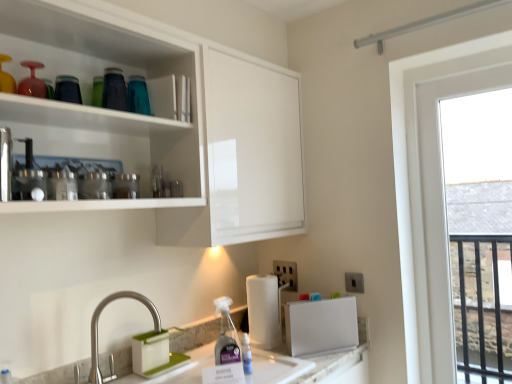
Question: Visually, is white plastic magnetic board at lower center, which is counted as the first appliance, starting from the right, positioned to the left or to the right of white matte paper towel at lower center?

Choices:
 (A) left
 (B) right

Answer: (B)

Question: From their relative heights in the image, would you say white plastic magnetic board at lower center, the second appliance from the left, is taller or shorter than white matte paper towel at lower center?

Choices:
 (A) short
 (B) tall

Answer: (A)

Question: Estimate the real-world distances between objects in this image. Which object is closer to the white plastic electric outlet at lower center, which is the second electric outlet in right-to-left order?

Choices:
 (A) white plastic electric outlet at lower right, placed as the first electric outlet when sorted from right to left
 (B) white plastic magnetic board at lower center, which is the first appliance from bottom to top
 (C) metallic silver blender at upper left, acting as the 1th appliance starting from the front
 (D) transparent glass window at right
 (E) polished stainless steel faucet at lower left

Answer: (A)

Question: Which of these objects is positioned closest to the polished stainless steel faucet at lower left?

Choices:
 (A) white matte paper towel at lower center
 (B) metallic silver blender at upper left, which is counted as the second appliance, starting from the bottom
 (C) white plastic electric outlet at lower right, placed as the first electric outlet when sorted from right to left
 (D) white plastic magnetic board at lower center, the second appliance viewed from the front
 (E) white plastic electric outlet at lower center, which is the second electric outlet in right-to-left order

Answer: (A)